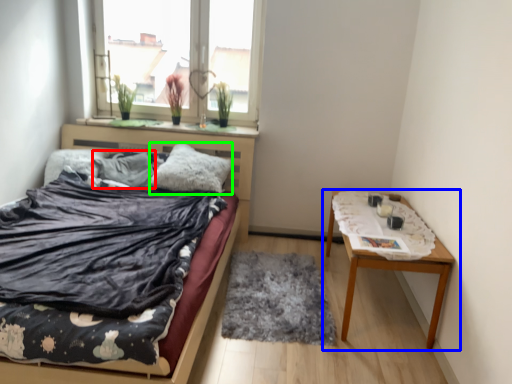
Question: Based on their relative distances, which object is nearer to pillow (highlighted by a red box)? Choose from table (highlighted by a blue box) and pillow (highlighted by a green box).

Choices:
 (A) table
 (B) pillow

Answer: (B)